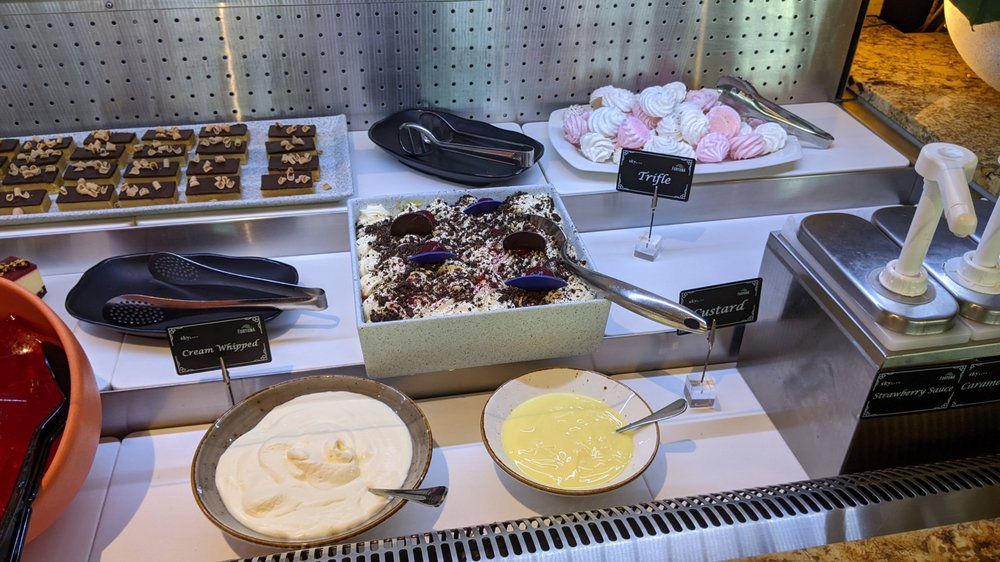
Identify the location of silver vent. The width and height of the screenshot is (1000, 562). tap(513, 539), tap(781, 501).